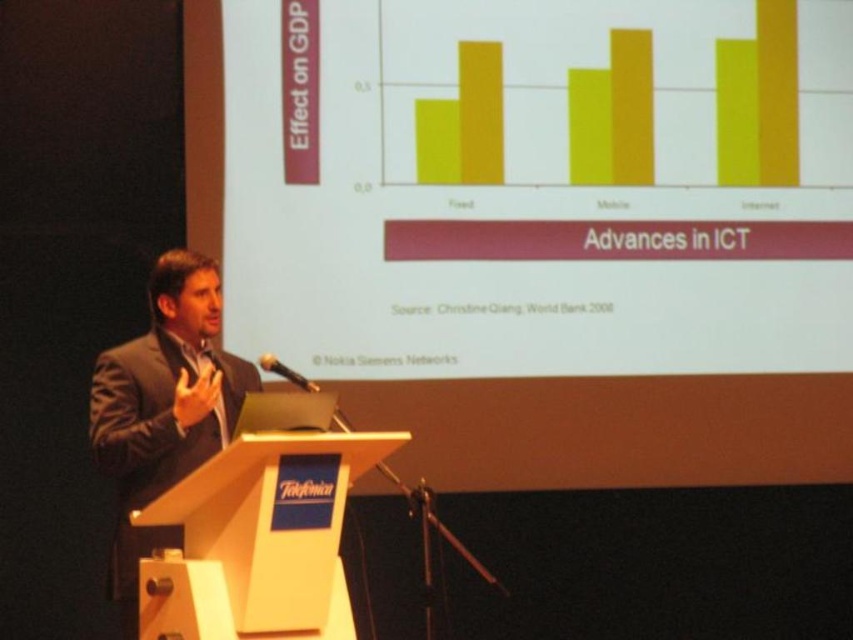
Question: Which point is closer to the camera taking this photo?

Choices:
 (A) (119, 486)
 (B) (177, 586)

Answer: (B)

Question: Is wooden podium at center positioned before dark suit at center?

Choices:
 (A) no
 (B) yes

Answer: (B)

Question: In this image, where is wooden podium at center located relative to dark suit at center?

Choices:
 (A) right
 (B) left

Answer: (A)

Question: Does wooden podium at center appear over dark suit at center?

Choices:
 (A) no
 (B) yes

Answer: (A)